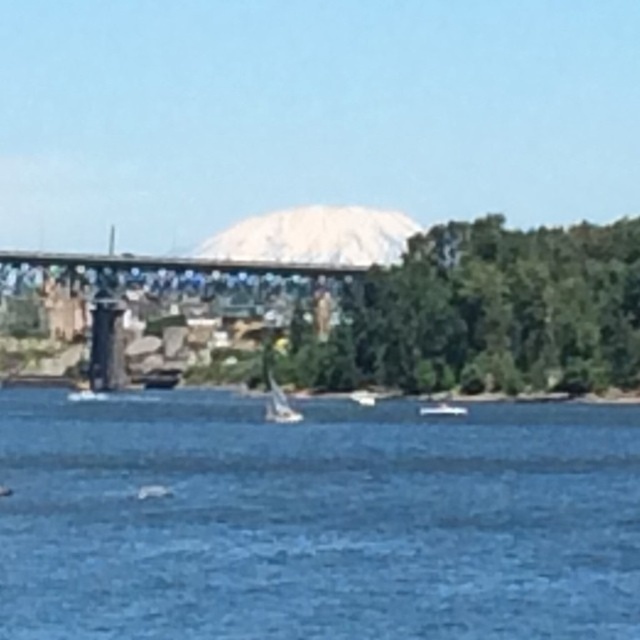
You are a photographer planning to capture the metal bridge at center and the white glossy sailboat at center in the same frame. Based on their sizes, which object would appear larger in the photo?

The metal bridge at center would appear larger in the photo since the description states it might be wider than the white glossy sailboat at center.

You are standing on the shore of the lake and see the metal bridge at center and the white matte sailboat at center. Which object is higher in elevation?

The metal bridge at center is above the white matte sailboat at center, so the metal bridge at center is higher in elevation.